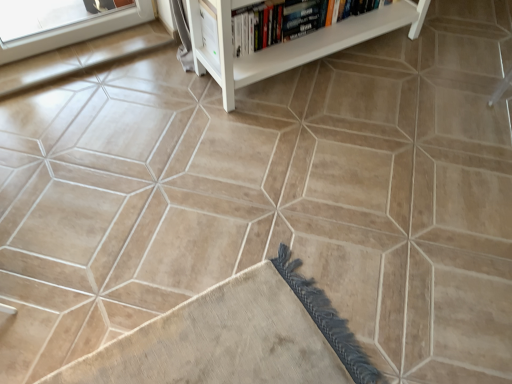
Identify the location of vacant space that is to the left of white matte shelf at upper center. The image size is (512, 384). coord(142,109).